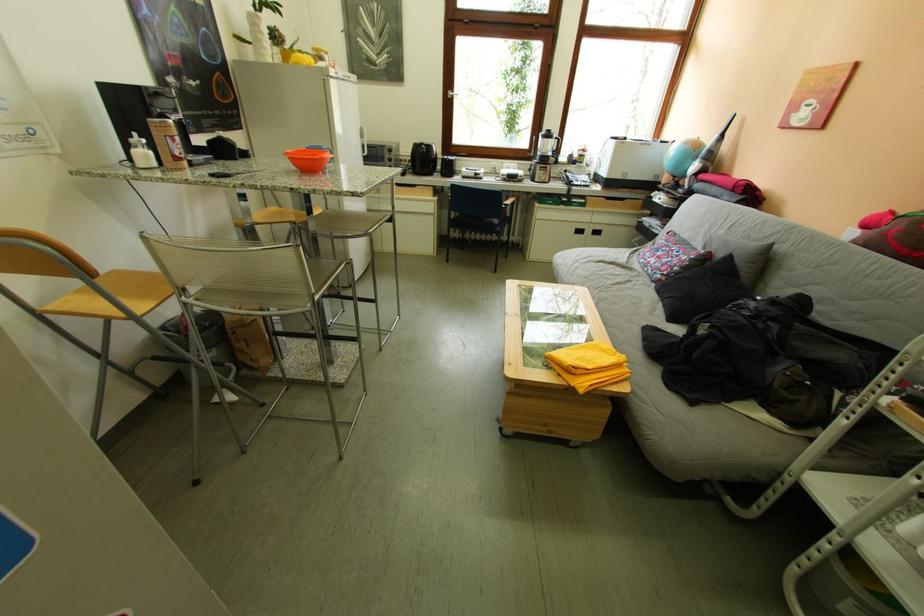
Locate an element on the screen. blender pitcher handle is located at coordinates (560, 169).